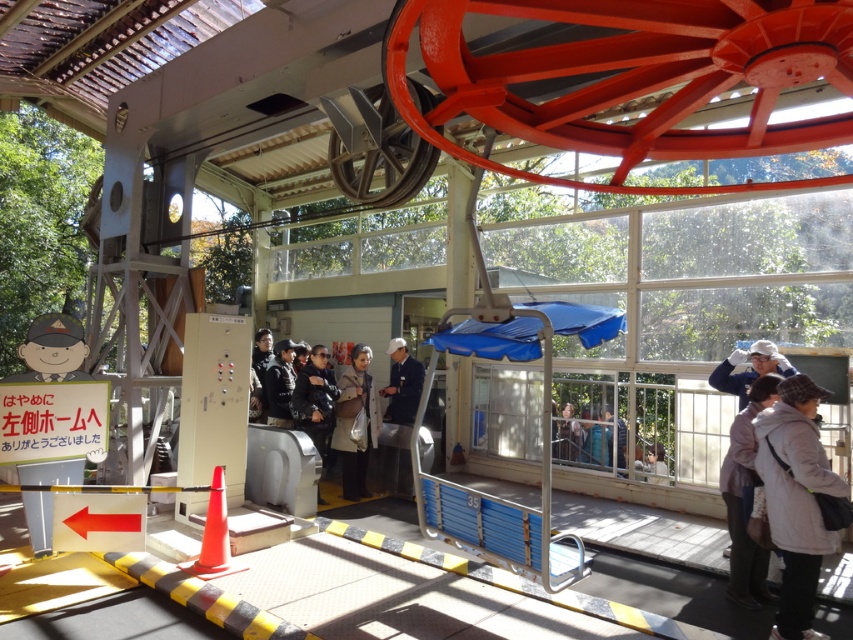
You are a photographer standing at the ski lift station and want to take a photo of both the brown leather jacket at center and the dark blue uniform at center. To ensure both are in the frame, should you adjust your camera to the left or right?

You should adjust your camera to the left because the brown leather jacket at center is to the left of the dark blue uniform at center, so centering both would require positioning the camera slightly left to include both objects in the frame.

You are a photographer standing at the ski lift station and want to take a photo of both the dark gray fabric coat at center and the dark blue uniform at center. Which one is positioned higher in the frame?

The dark gray fabric coat at center is above the dark blue uniform at center, so it is positioned higher in the frame.

You are a photographer positioned at the ski lift station. You want to take a photo of both the brown leather jacket at center and the dark blue uniform at center. Which one will appear larger in your photo?

The brown leather jacket at center will appear larger in the photo because it is closer to the viewer than the dark blue uniform at center.